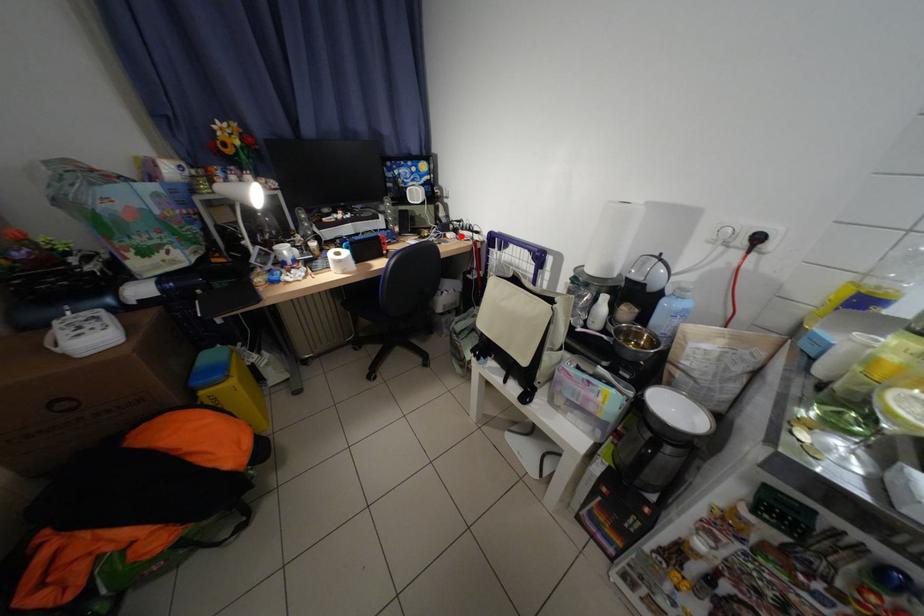
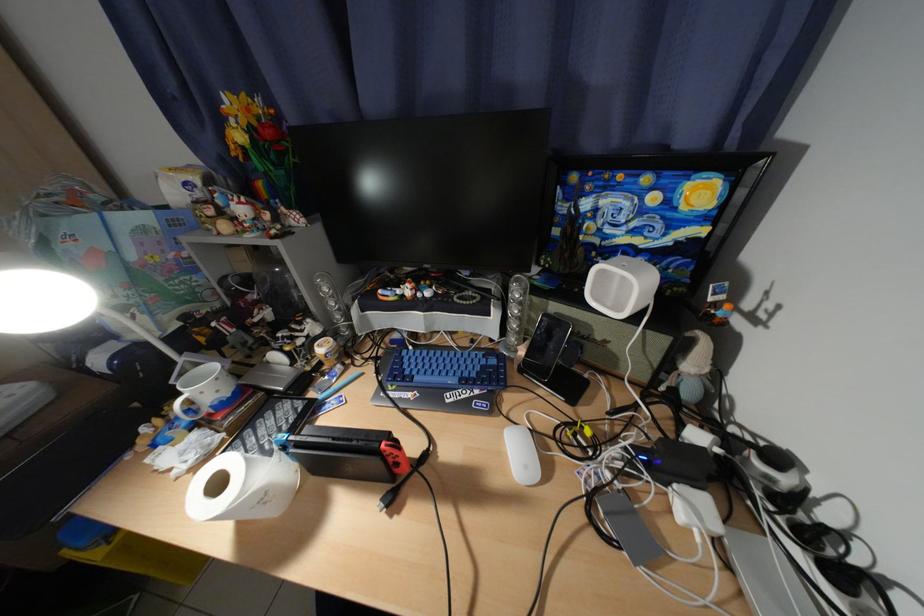
Find the pixel in the second image that matches the highlighted location in the first image.

(700, 508)